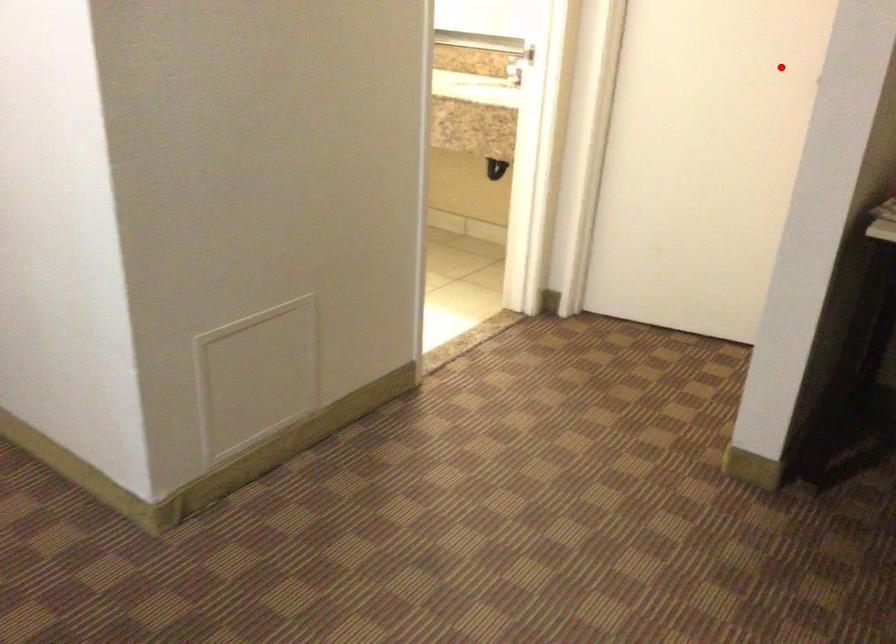
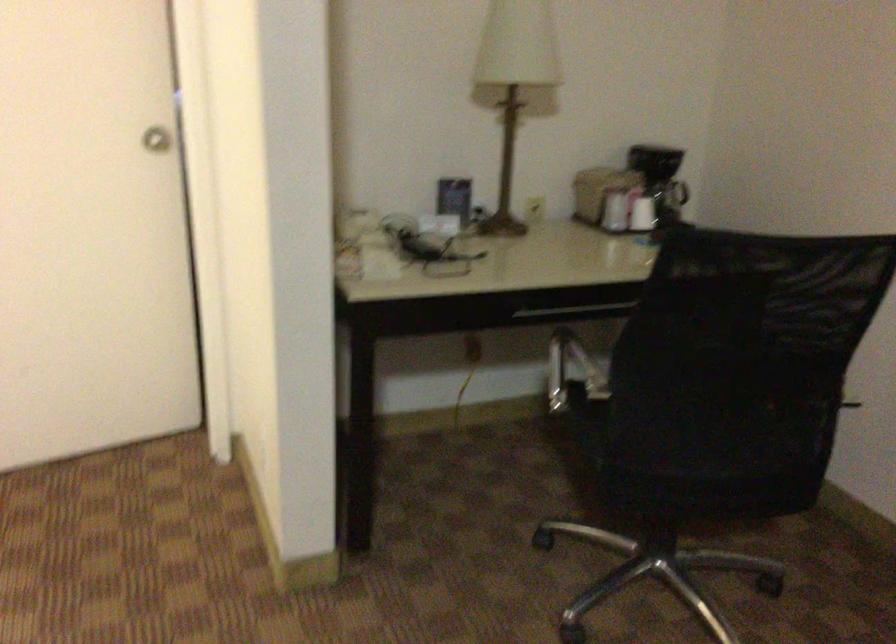
Question: I am providing you with two images of the same scene from different viewpoints. In image1, a red point is highlighted. Considering the same 3D point in image2, which of the following is correct?

Choices:
 (A) It is closer
 (B) It is farther

Answer: (A)